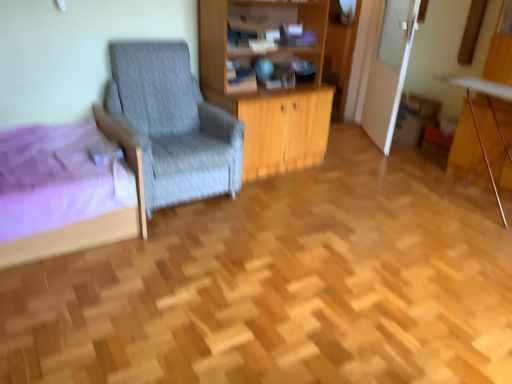
At what (x,y) coordinates should I click in order to perform the action: click on vacant area situated below wooden desk at right (from a real-world perspective). Please return your answer as a coordinate pair (x, y). The image size is (512, 384). Looking at the image, I should click on (458, 190).